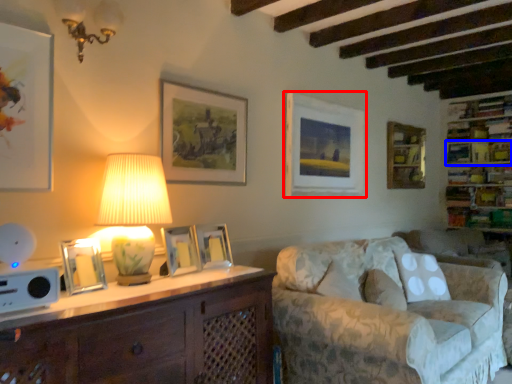
Question: Which object appears farthest to the camera in this image, picture frame (highlighted by a red box) or shelf (highlighted by a blue box)?

Choices:
 (A) picture frame
 (B) shelf

Answer: (B)